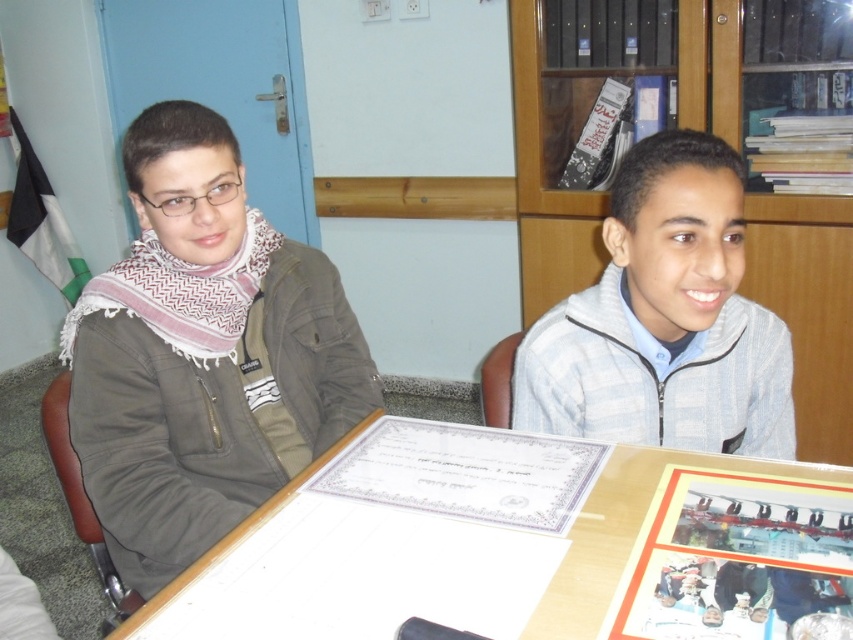
You are standing at the center of the table and want to reach both points. Which point, point (776, 508) or point (643, 392), is closer to you?

Point (643, 392) is closer to you because it is behind point (776, 508).